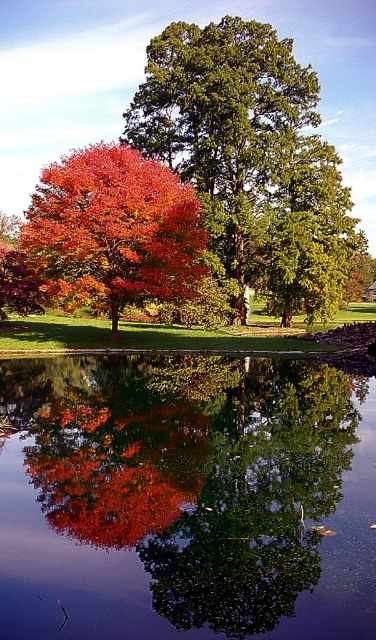
You are standing on the grassy area around the pond and want to take a photo of both the smooth glass lake at center and the green textured tree at center. Which object should you position closer to the left side of your camera frame to include both in the shot?

To include both the smooth glass lake at center and the green textured tree at center in your photo, you should position the smooth glass lake at center closer to the left side of your camera frame since it is already located to the left of the green textured tree at center.

You are standing at the edge of the pond and want to take a photo of the green textured tree at center. Based on its 2D coordinates, where should you position yourself to ensure the tree is centered in your camera frame?

To center the green textured tree at center in your camera frame, position yourself such that the tree aligns with the center point of your viewfinder, which corresponds to the coordinates provided at point (250,156).